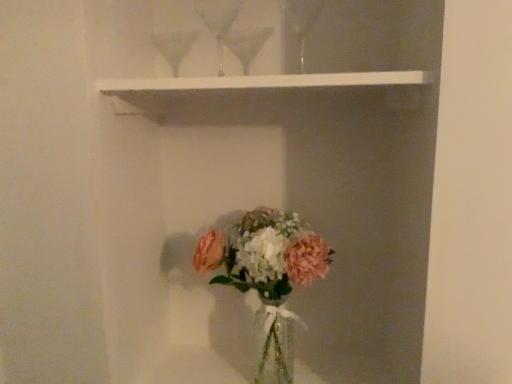
Where is `white matte shelf at upper center`? Image resolution: width=512 pixels, height=384 pixels. white matte shelf at upper center is located at coordinates (265, 81).

Describe the element at coordinates (265, 81) in the screenshot. I see `white matte shelf at upper center` at that location.

This screenshot has width=512, height=384. Describe the element at coordinates (267, 277) in the screenshot. I see `translucent glass vase at lower center` at that location.

Find the location of a particular element. translucent glass vase at lower center is located at coordinates (267, 277).

This screenshot has width=512, height=384. In order to click on white matte shelf at upper center in this screenshot , I will do `click(265, 81)`.

Considering the positions of objects white matte shelf at upper center and translucent glass vase at lower center in the image provided, who is more to the right, white matte shelf at upper center or translucent glass vase at lower center?

Positioned to the right is translucent glass vase at lower center.

Does white matte shelf at upper center lie in front of translucent glass vase at lower center?

Yes, it is in front of translucent glass vase at lower center.

Is point (333, 81) closer or farther from the camera than point (326, 275)?

Point (333, 81).

From the image's perspective, does white matte shelf at upper center appear lower than translucent glass vase at lower center?

Incorrect, from the image's perspective, white matte shelf at upper center is higher than translucent glass vase at lower center.

From the picture: From a real-world perspective, which is physically below, white matte shelf at upper center or translucent glass vase at lower center?

In real-world perspective, translucent glass vase at lower center is lower.

Does white matte shelf at upper center have a lesser width compared to translucent glass vase at lower center?

In fact, white matte shelf at upper center might be wider than translucent glass vase at lower center.

Who is shorter, white matte shelf at upper center or translucent glass vase at lower center?

white matte shelf at upper center is shorter.

Is white matte shelf at upper center bigger than translucent glass vase at lower center?

Incorrect, white matte shelf at upper center is not larger than translucent glass vase at lower center.

Is white matte shelf at upper center not inside translucent glass vase at lower center?

Yes, white matte shelf at upper center is located beyond the bounds of translucent glass vase at lower center.

Is white matte shelf at upper center not close to translucent glass vase at lower center?

white matte shelf at upper center is actually quite close to translucent glass vase at lower center.

Is white matte shelf at upper center aimed at translucent glass vase at lower center?

No, white matte shelf at upper center is not aimed at translucent glass vase at lower center.

What's the angular difference between white matte shelf at upper center and translucent glass vase at lower center's facing directions?

white matte shelf at upper center and translucent glass vase at lower center are facing 2.2 degrees away from each other.

Locate an element on the screen. This screenshot has height=384, width=512. window sill lying above the translucent glass vase at lower center (from the image's perspective) is located at coordinates (265, 81).

Considering the relative positions of translucent glass vase at lower center and white matte shelf at upper center in the image provided, is translucent glass vase at lower center to the left or to the right of white matte shelf at upper center?

Based on their positions, translucent glass vase at lower center is located to the right of white matte shelf at upper center.

Considering the positions of objects translucent glass vase at lower center and white matte shelf at upper center in the image provided, who is in front, translucent glass vase at lower center or white matte shelf at upper center?

white matte shelf at upper center.

Considering the positions of points (240, 246) and (255, 78), is point (240, 246) farther from camera compared to point (255, 78)?

Yes, point (240, 246) is behind point (255, 78).

From the image's perspective, is translucent glass vase at lower center on top of white matte shelf at upper center?

Incorrect, from the image's perspective, translucent glass vase at lower center is lower than white matte shelf at upper center.

From a real-world perspective, relative to white matte shelf at upper center, is translucent glass vase at lower center vertically above or below?

Clearly, from a real-world perspective, translucent glass vase at lower center is below white matte shelf at upper center.

Does translucent glass vase at lower center have a greater width compared to white matte shelf at upper center?

No.

Between translucent glass vase at lower center and white matte shelf at upper center, which one has more height?

translucent glass vase at lower center.

Between translucent glass vase at lower center and white matte shelf at upper center, which one has larger size?

Bigger between the two is translucent glass vase at lower center.

Choose the correct answer: Is translucent glass vase at lower center inside white matte shelf at upper center or outside it?

translucent glass vase at lower center is located beyond the bounds of white matte shelf at upper center.

Is translucent glass vase at lower center not close to white matte shelf at upper center?

translucent glass vase at lower center is actually quite close to white matte shelf at upper center.

Based on the photo, is translucent glass vase at lower center turned away from white matte shelf at upper center?

That's not correct — translucent glass vase at lower center is not looking away from white matte shelf at upper center.

How many degrees apart are the facing directions of translucent glass vase at lower center and white matte shelf at upper center?

The angular difference between translucent glass vase at lower center and white matte shelf at upper center is 2.2 degrees.

How distant is translucent glass vase at lower center from white matte shelf at upper center?

translucent glass vase at lower center and white matte shelf at upper center are 18.45 inches apart from each other.

Locate an element on the screen. This screenshot has height=384, width=512. window sill located above the translucent glass vase at lower center (from the image's perspective) is located at coordinates (265, 81).

Where is `floral arrangement that is behind the white matte shelf at upper center`? This screenshot has height=384, width=512. floral arrangement that is behind the white matte shelf at upper center is located at coordinates (267, 277).

At what (x,y) coordinates should I click in order to perform the action: click on window sill above the translucent glass vase at lower center (from a real-world perspective). Please return your answer as a coordinate pair (x, y). The width and height of the screenshot is (512, 384). Looking at the image, I should click on (265, 81).